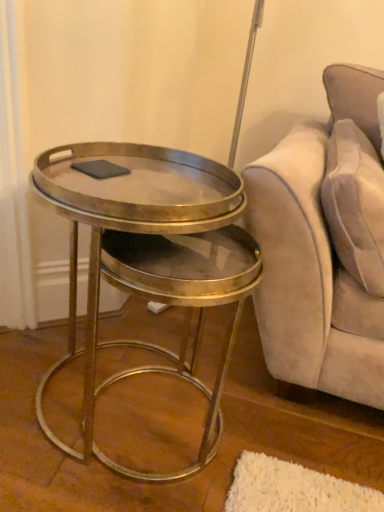
Question: Is suede-like beige pillow at upper right inside the boundaries of gray matte pad at center, or outside?

Choices:
 (A) outside
 (B) inside

Answer: (A)

Question: Considering the positions of suede-like beige pillow at upper right and gray matte pad at center in the image, is suede-like beige pillow at upper right taller or shorter than gray matte pad at center?

Choices:
 (A) tall
 (B) short

Answer: (A)

Question: Estimate the real-world distances between objects in this image. Which object is farther from the gray matte pad at center?

Choices:
 (A) metallic/goldenobject at left
 (B) suede-like beige pillow at upper right

Answer: (B)

Question: Considering the real-world distances, which object is farthest from the gray matte pad at center?

Choices:
 (A) suede-like beige pillow at upper right
 (B) metallic/goldenobject at left

Answer: (A)